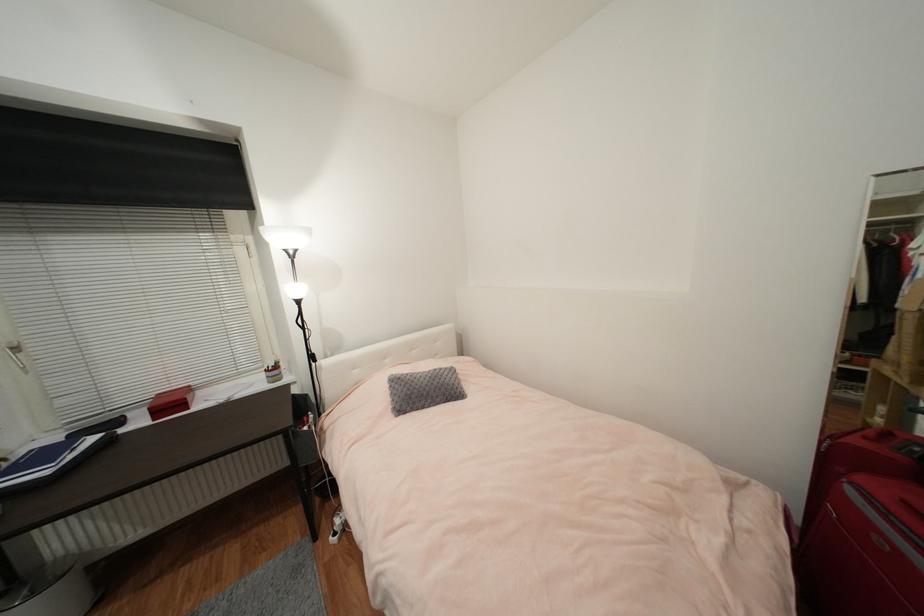
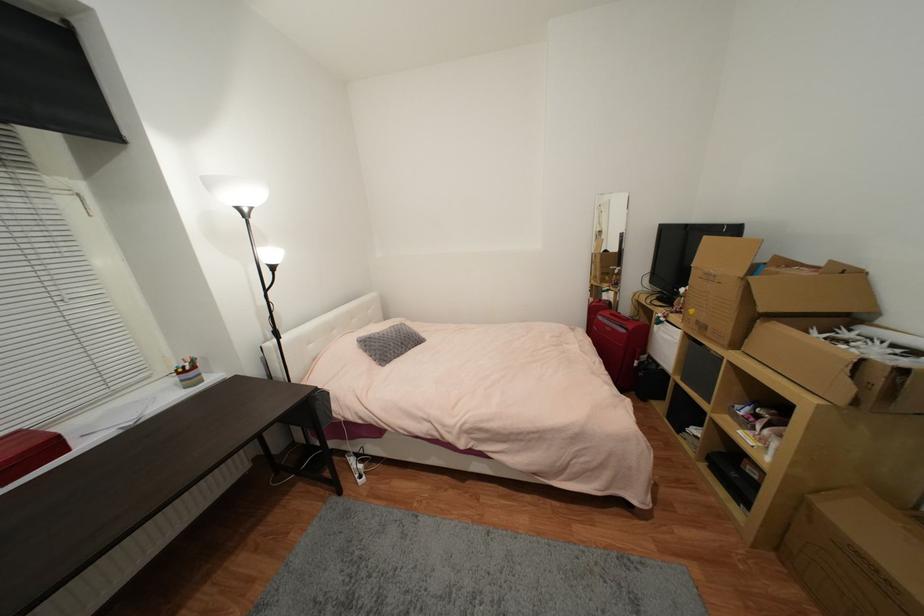
Question: The camera is either moving clockwise (left) or counter-clockwise (right) around the object. The first image is from the beginning of the video and the second image is from the end. Is the camera moving left or right when shooting the video?

Choices:
 (A) Left
 (B) Right

Answer: (A)